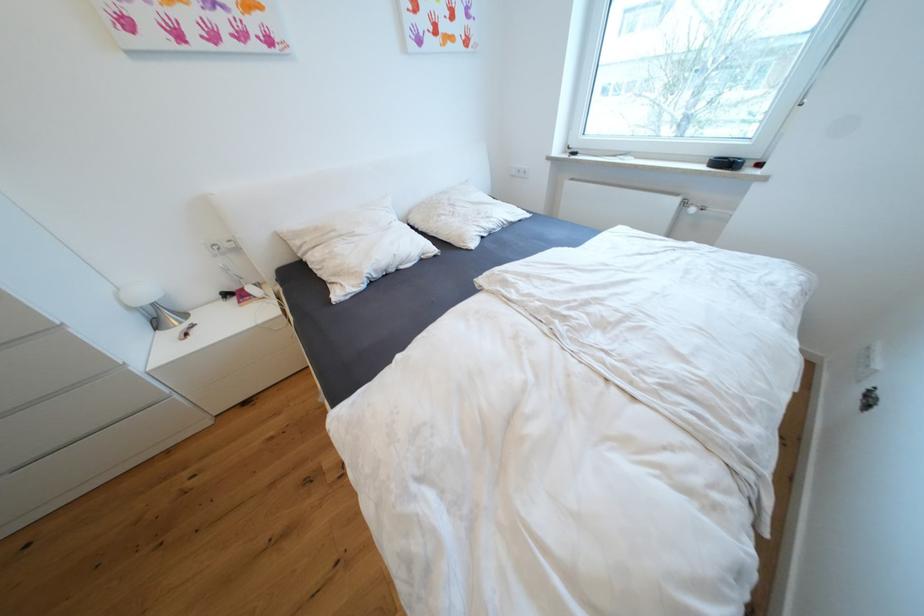
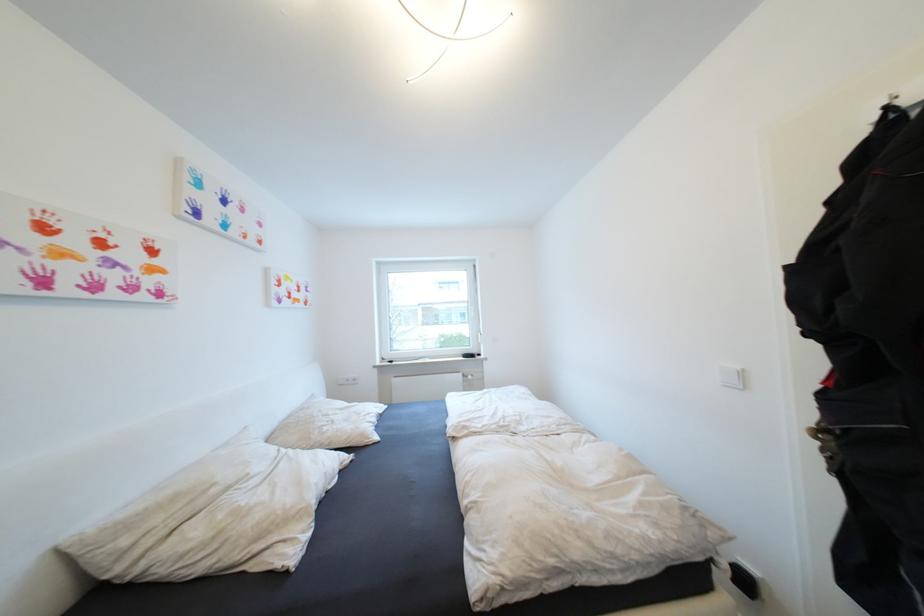
In the second image, find the point that corresponds to the point at 305,244 in the first image.

(131, 543)